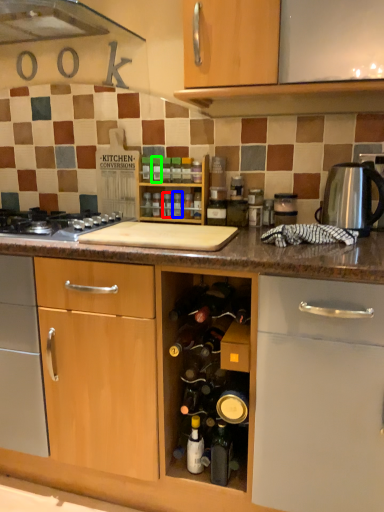
Question: Based on their relative distances, which object is nearer to bottle (highlighted by a red box)? Choose from bottle (highlighted by a blue box) and bottle (highlighted by a green box).

Choices:
 (A) bottle
 (B) bottle

Answer: (A)